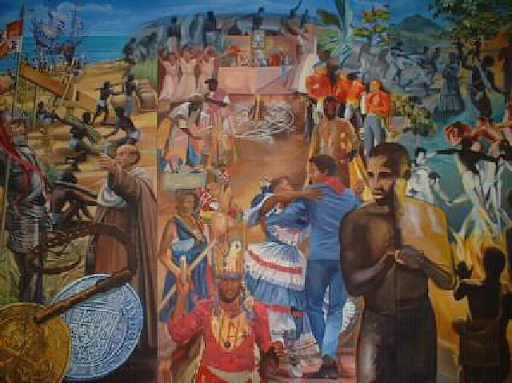
The width and height of the screenshot is (512, 383). I want to click on three in a row white robes, so click(x=212, y=68), click(x=187, y=70), click(x=168, y=72).